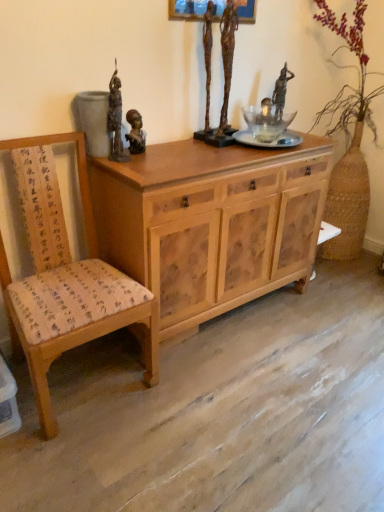
This screenshot has height=512, width=384. Find the location of `vacant area that lies between wooden chair with fabric cushion at left and natural wood cabinet at center`. vacant area that lies between wooden chair with fabric cushion at left and natural wood cabinet at center is located at coordinates (224, 347).